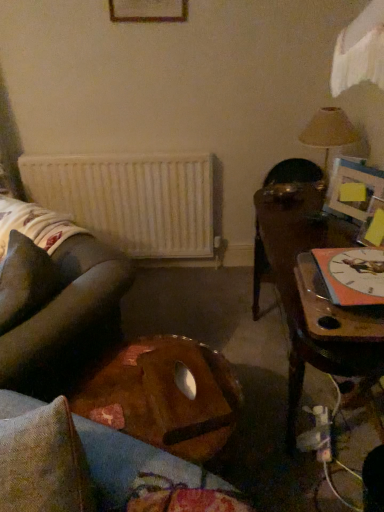
Question: Can we say wooden table at right, the first table in the right-to-left sequence, lies outside white matte radiator at center?

Choices:
 (A) yes
 (B) no

Answer: (A)

Question: From the image's perspective, would you say wooden table at right, the first table in the right-to-left sequence, is positioned over white matte radiator at center?

Choices:
 (A) yes
 (B) no

Answer: (B)

Question: Does wooden table at right, the 2th table viewed from the left, have a greater width compared to white matte radiator at center?

Choices:
 (A) no
 (B) yes

Answer: (B)

Question: Considering the relative sizes of wooden table at right, the first table in the right-to-left sequence, and white matte radiator at center in the image provided, is wooden table at right, the first table in the right-to-left sequence, smaller than white matte radiator at center?

Choices:
 (A) no
 (B) yes

Answer: (A)

Question: From a real-world perspective, is wooden table at right, the first table in the right-to-left sequence, below white matte radiator at center?

Choices:
 (A) no
 (B) yes

Answer: (B)

Question: From a real-world perspective, is wooden table at right, the first table in the right-to-left sequence, above or below brown fabric pillow at lower left?

Choices:
 (A) above
 (B) below

Answer: (B)

Question: Considering the positions of point (302, 224) and point (33, 275), is point (302, 224) closer or farther from the camera than point (33, 275)?

Choices:
 (A) farther
 (B) closer

Answer: (A)

Question: Is wooden table at right, the first table in the right-to-left sequence, to the left or to the right of brown fabric pillow at lower left in the image?

Choices:
 (A) left
 (B) right

Answer: (B)

Question: Considering the positions of wooden table at right, the 2th table viewed from the left, and brown fabric pillow at lower left in the image, is wooden table at right, the 2th table viewed from the left, taller or shorter than brown fabric pillow at lower left?

Choices:
 (A) short
 (B) tall

Answer: (B)

Question: Is matte beige lampshade at upper right to the left or to the right of wooden table at right, the 2th table viewed from the left, in the image?

Choices:
 (A) right
 (B) left

Answer: (A)

Question: Considering the positions of matte beige lampshade at upper right and wooden table at right, the 2th table viewed from the left, in the image, is matte beige lampshade at upper right bigger or smaller than wooden table at right, the 2th table viewed from the left,?

Choices:
 (A) big
 (B) small

Answer: (B)

Question: Which is correct: matte beige lampshade at upper right is inside wooden table at right, the first table in the right-to-left sequence, or outside of it?

Choices:
 (A) inside
 (B) outside

Answer: (B)

Question: Looking at their shapes, would you say matte beige lampshade at upper right is wider or thinner than wooden table at right, the 2th table viewed from the left?

Choices:
 (A) thin
 (B) wide

Answer: (A)

Question: Considering the positions of white matte radiator at center and matte beige lampshade at upper right in the image, is white matte radiator at center wider or thinner than matte beige lampshade at upper right?

Choices:
 (A) thin
 (B) wide

Answer: (A)

Question: Is white matte radiator at center situated inside matte beige lampshade at upper right or outside?

Choices:
 (A) inside
 (B) outside

Answer: (B)